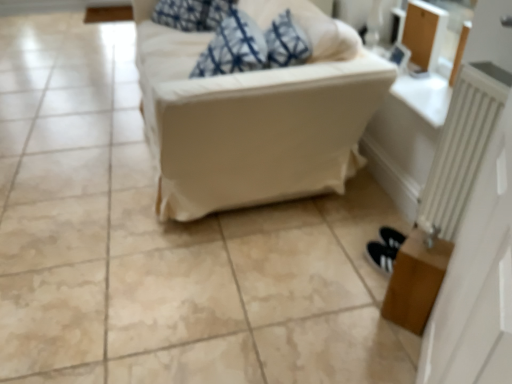
The height and width of the screenshot is (384, 512). Find the location of `vacant space that is in between white fabric couch at center and brown wooden table at lower right`. vacant space that is in between white fabric couch at center and brown wooden table at lower right is located at coordinates (300, 253).